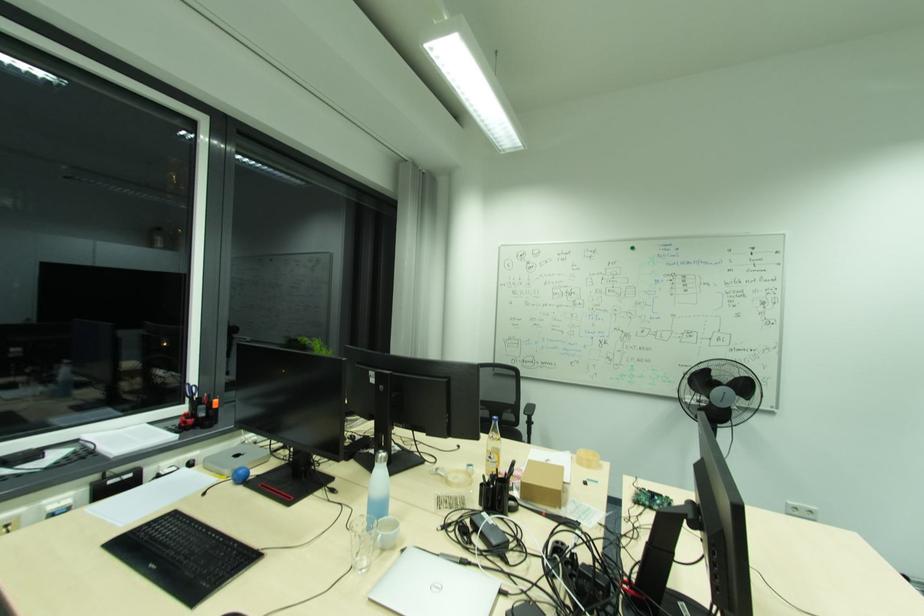
The width and height of the screenshot is (924, 616). In order to click on small cardboard box in this screenshot , I will do `click(542, 484)`.